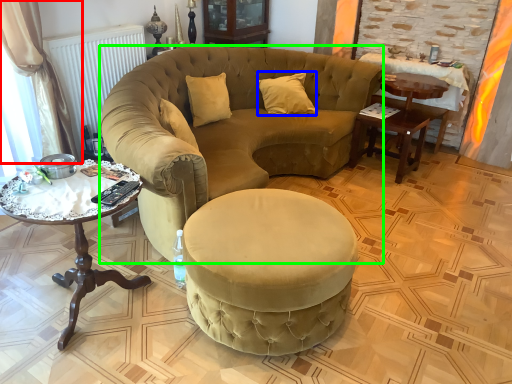
Question: Based on their relative distances, which object is nearer to curtain (highlighted by a red box)? Choose from pillow (highlighted by a blue box) and chair (highlighted by a green box).

Choices:
 (A) pillow
 (B) chair

Answer: (B)